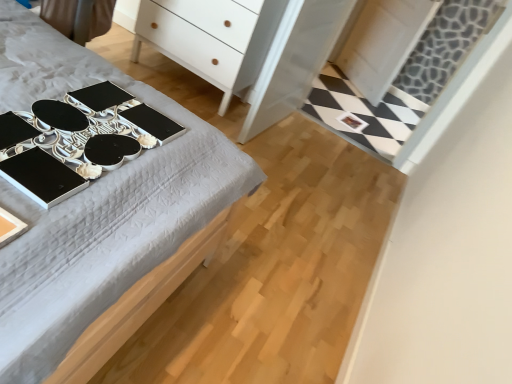
The image size is (512, 384). I want to click on white matte chest of drawers at upper center, so click(x=195, y=43).

What do you see at coordinates (97, 192) in the screenshot?
I see `black glossy desk at upper left` at bounding box center [97, 192].

This screenshot has height=384, width=512. I want to click on white glossy dresser at center, so click(255, 53).

What do you see at coordinates (78, 140) in the screenshot? The width and height of the screenshot is (512, 384). I see `metallic silver changing table at upper left` at bounding box center [78, 140].

The width and height of the screenshot is (512, 384). Find the location of `white matte chest of drawers at upper center`. white matte chest of drawers at upper center is located at coordinates (195, 43).

Does white matte chest of drawers at upper center have a smaller size compared to white glossy dresser at center?

No, white matte chest of drawers at upper center is not smaller than white glossy dresser at center.

How far apart are white matte chest of drawers at upper center and white glossy dresser at center?

6.58 inches.

Is the position of white matte chest of drawers at upper center less distant than that of white glossy dresser at center?

No, white matte chest of drawers at upper center is behind white glossy dresser at center.

Can we say white matte chest of drawers at upper center lies outside white glossy dresser at center?

white matte chest of drawers at upper center is positioned outside white glossy dresser at center.

Can you confirm if metallic silver changing table at upper left is bigger than black glossy desk at upper left?

No.

From a real-world perspective, is metallic silver changing table at upper left on top of black glossy desk at upper left?

Yes, from a real-world perspective, metallic silver changing table at upper left is over black glossy desk at upper left

Are metallic silver changing table at upper left and black glossy desk at upper left located far from each other?

No, there isn't a large distance between metallic silver changing table at upper left and black glossy desk at upper left.

Considering the relative positions of metallic silver changing table at upper left and black glossy desk at upper left in the image provided, is metallic silver changing table at upper left to the left of black glossy desk at upper left from the viewer's perspective?

Incorrect, metallic silver changing table at upper left is not on the left side of black glossy desk at upper left.

From the image's perspective, is black glossy desk at upper left under white matte chest of drawers at upper center?

Indeed, from the image's perspective, black glossy desk at upper left is shown beneath white matte chest of drawers at upper center.

Is black glossy desk at upper left not near white matte chest of drawers at upper center?

Absolutely, black glossy desk at upper left is distant from white matte chest of drawers at upper center.

From a real-world perspective, which is physically below, black glossy desk at upper left or white matte chest of drawers at upper center?

black glossy desk at upper left, from a real-world perspective.

Could you tell me if black glossy desk at upper left is facing white matte chest of drawers at upper center?

No, black glossy desk at upper left is not oriented towards white matte chest of drawers at upper center.

In the image, is white glossy dresser at center on the left side or the right side of white matte chest of drawers at upper center?

Clearly, white glossy dresser at center is on the right of white matte chest of drawers at upper center in the image.

How many degrees apart are the facing directions of white glossy dresser at center and white matte chest of drawers at upper center?

There is a 79.9-degree angle between the facing directions of white glossy dresser at center and white matte chest of drawers at upper center.

I want to click on dresser located above the white matte chest of drawers at upper center (from a real-world perspective), so click(x=255, y=53).

Considering the sizes of objects white glossy dresser at center and white matte chest of drawers at upper center in the image provided, who is taller, white glossy dresser at center or white matte chest of drawers at upper center?

With more height is white glossy dresser at center.

Visually, is black glossy desk at upper left positioned to the left or to the right of white glossy dresser at center?

Clearly, black glossy desk at upper left is on the left of white glossy dresser at center in the image.

Looking at this image, which object is closer to the camera taking this photo, black glossy desk at upper left or white glossy dresser at center?

black glossy desk at upper left is more forward.

Can you tell me how much black glossy desk at upper left and white glossy dresser at center differ in facing direction?

The facing directions of black glossy desk at upper left and white glossy dresser at center are 100 degrees apart.

I want to click on desk located in front of the white glossy dresser at center, so point(97,192).

Considering the relative positions of white matte chest of drawers at upper center and metallic silver changing table at upper left in the image provided, is white matte chest of drawers at upper center to the left of metallic silver changing table at upper left from the viewer's perspective?

No.

In the scene shown: Is white matte chest of drawers at upper center inside or outside of metallic silver changing table at upper left?

The correct answer is: outside.

Is white matte chest of drawers at upper center positioned far away from metallic silver changing table at upper left?

Indeed, white matte chest of drawers at upper center is not near metallic silver changing table at upper left.

Is white matte chest of drawers at upper center taller than metallic silver changing table at upper left?

Indeed, white matte chest of drawers at upper center has a greater height compared to metallic silver changing table at upper left.

From the image's perspective, between white glossy dresser at center and metallic silver changing table at upper left, who is located below?

metallic silver changing table at upper left, from the image's perspective.

Can you confirm if white glossy dresser at center is smaller than metallic silver changing table at upper left?

No, white glossy dresser at center is not smaller than metallic silver changing table at upper left.

Which of these two, white glossy dresser at center or metallic silver changing table at upper left, is thinner?

With smaller width is white glossy dresser at center.

Is white glossy dresser at center aimed at metallic silver changing table at upper left?

No, white glossy dresser at center is not aimed at metallic silver changing table at upper left.

Identify the location of dresser located above the white matte chest of drawers at upper center (from a real-world perspective). (255, 53).

Find the location of a particular element. changing table to the right of black glossy desk at upper left is located at coordinates (78, 140).

In the scene shown: From the image, which object appears to be farther from white glossy dresser at center, white matte chest of drawers at upper center or metallic silver changing table at upper left?

metallic silver changing table at upper left lies further to white glossy dresser at center than the other object.

Considering their positions, is metallic silver changing table at upper left positioned further to black glossy desk at upper left than white glossy dresser at center?

white glossy dresser at center is further to black glossy desk at upper left.

Based on their spatial positions, is white glossy dresser at center or black glossy desk at upper left further from metallic silver changing table at upper left?

white glossy dresser at center.

Considering their positions, is black glossy desk at upper left positioned closer to white glossy dresser at center than metallic silver changing table at upper left?

black glossy desk at upper left lies closer to white glossy dresser at center than the other object.

Estimate the real-world distances between objects in this image. Which object is closer to black glossy desk at upper left, white glossy dresser at center or metallic silver changing table at upper left?

Among the two, metallic silver changing table at upper left is located nearer to black glossy desk at upper left.

When comparing their distances from white glossy dresser at center, does metallic silver changing table at upper left or black glossy desk at upper left seem closer?

black glossy desk at upper left is closer to white glossy dresser at center.

In the scene shown: Estimate the real-world distances between objects in this image. Which object is further from metallic silver changing table at upper left, white glossy dresser at center or white matte chest of drawers at upper center?

white matte chest of drawers at upper center is further to metallic silver changing table at upper left.

From the image, which object appears to be nearer to white glossy dresser at center, metallic silver changing table at upper left or white matte chest of drawers at upper center?

Among the two, white matte chest of drawers at upper center is located nearer to white glossy dresser at center.

Identify the location of desk located between metallic silver changing table at upper left and white glossy dresser at center in the depth direction. (97, 192).

At what (x,y) coordinates should I click in order to perform the action: click on desk between metallic silver changing table at upper left and white matte chest of drawers at upper center along the z-axis. Please return your answer as a coordinate pair (x, y). Looking at the image, I should click on (97, 192).

The width and height of the screenshot is (512, 384). Find the location of `dresser between metallic silver changing table at upper left and white matte chest of drawers at upper center along the z-axis`. dresser between metallic silver changing table at upper left and white matte chest of drawers at upper center along the z-axis is located at coordinates [x=255, y=53].

Find the location of `dresser located between black glossy desk at upper left and white matte chest of drawers at upper center in the depth direction`. dresser located between black glossy desk at upper left and white matte chest of drawers at upper center in the depth direction is located at coordinates (255, 53).